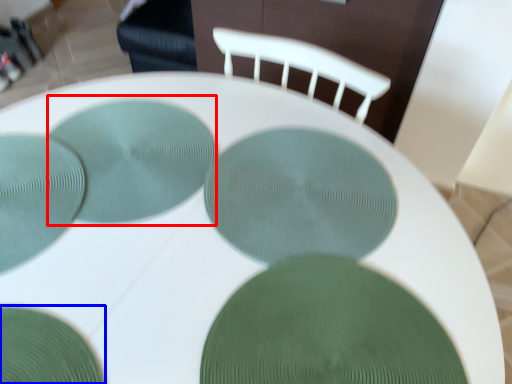
Question: Among these objects, which one is farthest to the camera, glass plate (highlighted by a red box) or glass plate (highlighted by a blue box)?

Choices:
 (A) glass plate
 (B) glass plate

Answer: (A)